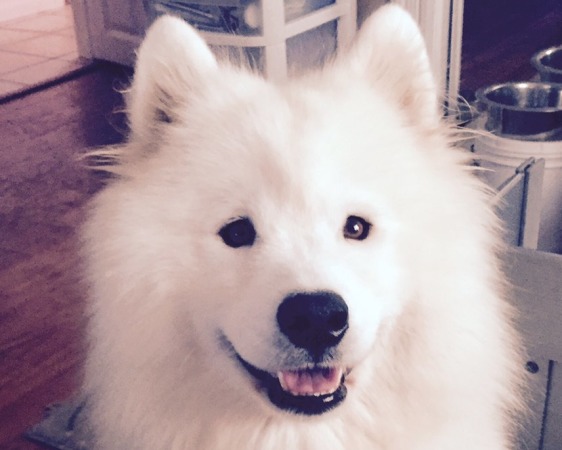
I want to click on pots, so click(520, 102), click(549, 54).